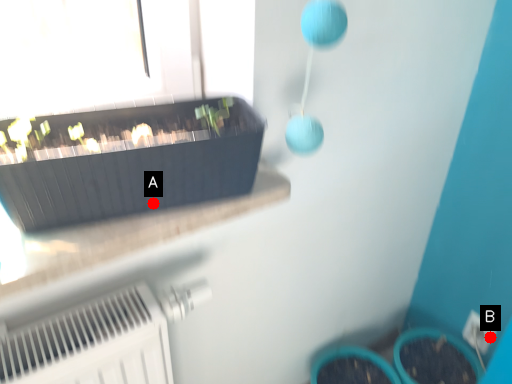
Question: Two points are circled on the image, labeled by A and B beside each circle. Which of the following is the closest to the observer?

Choices:
 (A) A is closer
 (B) B is closer

Answer: (A)